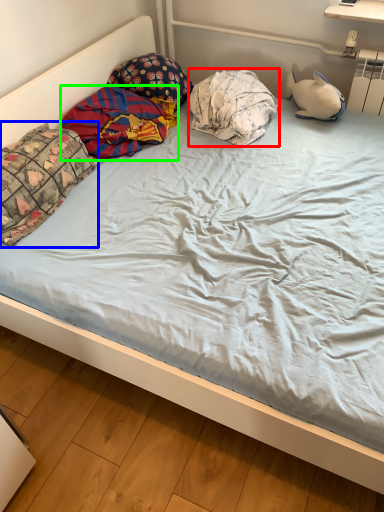
Question: Which object is the closest to the pillow (highlighted by a red box)? Choose among these: pillow (highlighted by a blue box) or material (highlighted by a green box).

Choices:
 (A) pillow
 (B) material

Answer: (B)